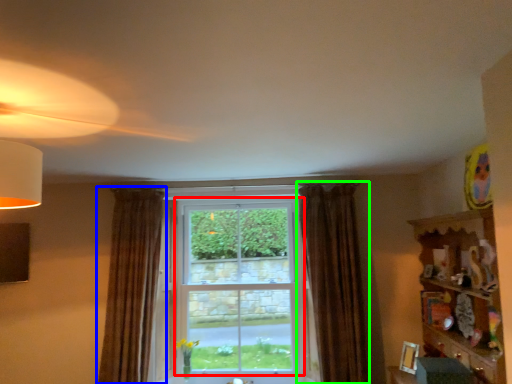
Question: Which object is positioned farthest from window (highlighted by a red box)? Select from curtain (highlighted by a blue box) and curtain (highlighted by a green box).

Choices:
 (A) curtain
 (B) curtain

Answer: (A)